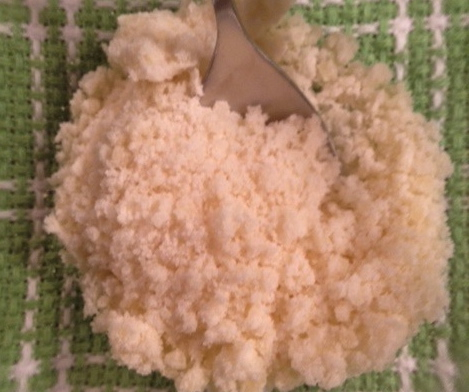
The image size is (469, 392). In order to click on table in this screenshot , I will do `click(42, 30)`.